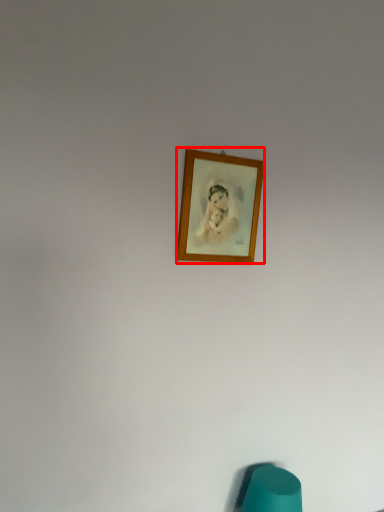
Question: Where is picture frame (annotated by the red box) located in relation to bean bag chair in the image?

Choices:
 (A) right
 (B) left

Answer: (B)